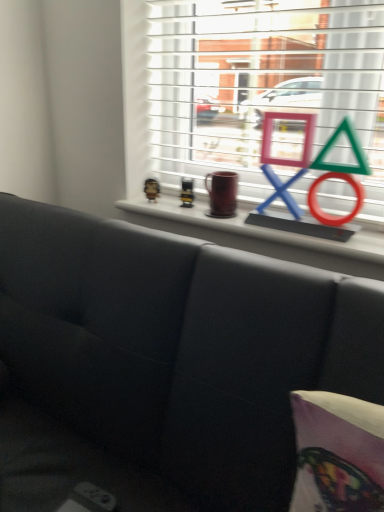
Measure the distance between point (184, 202) and camera.

Point (184, 202) and camera are 1.36 meters apart from each other.

You are a GUI agent. You are given a task and a screenshot of the screen. Output one action in this format:
    pyautogui.click(x=<x>, y=<y>)
    Task: Click on the metallic silver toy at upper center, the 1th toy positioned from the right
    
    Given the screenshot: What is the action you would take?
    pyautogui.click(x=187, y=192)

Looking at this image, from the image's perspective, is matte black couch at center beneath metallic gold figurine at upper center, which is the second toy from right to left?

Indeed, from the image's perspective, matte black couch at center is shown beneath metallic gold figurine at upper center, which is the second toy from right to left.

From a real-world perspective, is matte black couch at center positioned above or below metallic gold figurine at upper center, the first toy from the left?

Clearly, from a real-world perspective, matte black couch at center is below metallic gold figurine at upper center, the first toy from the left.

Which is farther, (161, 282) or (158, 190)?

The point (158, 190) is behind.

Is matte black couch at center facing towards metallic gold figurine at upper center, which is the second toy from right to left?

No, matte black couch at center is not turned towards metallic gold figurine at upper center, which is the second toy from right to left.

Is metallic silver toy at upper center, the 2th toy from the left, in contact with matte black couch at center?

No, metallic silver toy at upper center, the 2th toy from the left, is not in contact with matte black couch at center.

Is metallic silver toy at upper center, the 2th toy from the left, facing towards matte black couch at center?

Yes.

There is a matte black couch at center. Where is `the 1st toy above it (from the image's perspective)`? This screenshot has height=512, width=384. the 1st toy above it (from the image's perspective) is located at coordinates (187, 192).

Which is more to the left, metallic silver toy at upper center, the 2th toy from the left, or matte black couch at center?

matte black couch at center.

From a real-world perspective, who is located higher, metallic silver toy at upper center, the 2th toy from the left, or metallic gold figurine at upper center, which is the second toy from right to left?

In real-world perspective, metallic silver toy at upper center, the 2th toy from the left, is above.

Considering the positions of objects metallic silver toy at upper center, the 1th toy positioned from the right, and metallic gold figurine at upper center, which is the second toy from right to left, in the image provided, who is more to the left, metallic silver toy at upper center, the 1th toy positioned from the right, or metallic gold figurine at upper center, which is the second toy from right to left,?

From the viewer's perspective, metallic gold figurine at upper center, which is the second toy from right to left, appears more on the left side.

At what (x,y) coordinates should I click in order to perform the action: click on toy on the right of metallic gold figurine at upper center, which is the second toy from right to left. Please return your answer as a coordinate pair (x, y). The width and height of the screenshot is (384, 512). Looking at the image, I should click on (187, 192).

Is metallic silver toy at upper center, the 2th toy from the left, positioned in front of metallic gold figurine at upper center, the first toy from the left?

That is True.

Is metallic gold figurine at upper center, which is the second toy from right to left, far away from matte black couch at center?

metallic gold figurine at upper center, which is the second toy from right to left, is actually quite close to matte black couch at center.

Starting from the matte black couch at center, which toy is the 2nd one behind? Please provide its 2D coordinates.

[(151, 189)]

Considering the sizes of objects metallic gold figurine at upper center, the first toy from the left, and matte black couch at center in the image provided, who is taller, metallic gold figurine at upper center, the first toy from the left, or matte black couch at center?

matte black couch at center is taller.

Is the surface of matte black couch at center in direct contact with metallic silver toy at upper center, the 2th toy from the left?

matte black couch at center is not next to metallic silver toy at upper center, the 2th toy from the left, and they're not touching.

Locate an element on the screen. The width and height of the screenshot is (384, 512). studio couch on the left of metallic silver toy at upper center, the 2th toy from the left is located at coordinates (164, 362).

Is metallic silver toy at upper center, the 1th toy positioned from the right, located within matte black couch at center?

Actually, metallic silver toy at upper center, the 1th toy positioned from the right, is outside matte black couch at center.

From a real-world perspective, which object rests below the other?

In real-world perspective, matte black couch at center is lower.

In the scene shown: Is metallic gold figurine at upper center, which is the second toy from right to left, to the left or to the right of metallic silver toy at upper center, the 2th toy from the left, in the image?

metallic gold figurine at upper center, which is the second toy from right to left, is positioned on metallic silver toy at upper center, the 2th toy from the left,'s left side.

Considering the sizes of objects metallic gold figurine at upper center, which is the second toy from right to left, and metallic silver toy at upper center, the 1th toy positioned from the right, in the image provided, who is smaller, metallic gold figurine at upper center, which is the second toy from right to left, or metallic silver toy at upper center, the 1th toy positioned from the right,?

metallic silver toy at upper center, the 1th toy positioned from the right, is smaller.

Is metallic gold figurine at upper center, the first toy from the left, positioned beyond the bounds of metallic silver toy at upper center, the 1th toy positioned from the right?

Yes, metallic gold figurine at upper center, the first toy from the left, is not within metallic silver toy at upper center, the 1th toy positioned from the right.

Where is `studio couch below the metallic gold figurine at upper center, the first toy from the left (from the image's perspective)`? The height and width of the screenshot is (512, 384). studio couch below the metallic gold figurine at upper center, the first toy from the left (from the image's perspective) is located at coordinates (164, 362).

Identify the location of toy that is the 1st one when counting upward from the matte black couch at center (from the image's perspective). (187, 192).

Estimate the real-world distances between objects in this image. Which object is further from matte black couch at center, metallic silver toy at upper center, the 2th toy from the left, or metallic gold figurine at upper center, which is the second toy from right to left?

metallic gold figurine at upper center, which is the second toy from right to left, is further to matte black couch at center.

Which object lies further to the anchor point matte black couch at center, metallic gold figurine at upper center, which is the second toy from right to left, or metallic silver toy at upper center, the 2th toy from the left?

metallic gold figurine at upper center, which is the second toy from right to left, is positioned further to the anchor matte black couch at center.

From the image, which object appears to be farther from metallic silver toy at upper center, the 2th toy from the left, matte black couch at center or metallic gold figurine at upper center, the first toy from the left?

matte black couch at center lies further to metallic silver toy at upper center, the 2th toy from the left, than the other object.

Which object lies further to the anchor point metallic silver toy at upper center, the 1th toy positioned from the right, metallic gold figurine at upper center, the first toy from the left, or matte black couch at center?

matte black couch at center lies further to metallic silver toy at upper center, the 1th toy positioned from the right, than the other object.

Which object lies nearer to the anchor point metallic gold figurine at upper center, which is the second toy from right to left, matte black couch at center or metallic silver toy at upper center, the 2th toy from the left?

metallic silver toy at upper center, the 2th toy from the left.

Considering their positions, is metallic silver toy at upper center, the 1th toy positioned from the right, positioned further to metallic gold figurine at upper center, which is the second toy from right to left, than matte black couch at center?

matte black couch at center lies further to metallic gold figurine at upper center, which is the second toy from right to left, than the other object.

The width and height of the screenshot is (384, 512). Find the location of `toy between matte black couch at center and metallic gold figurine at upper center, the first toy from the left, along the z-axis`. toy between matte black couch at center and metallic gold figurine at upper center, the first toy from the left, along the z-axis is located at coordinates (187, 192).